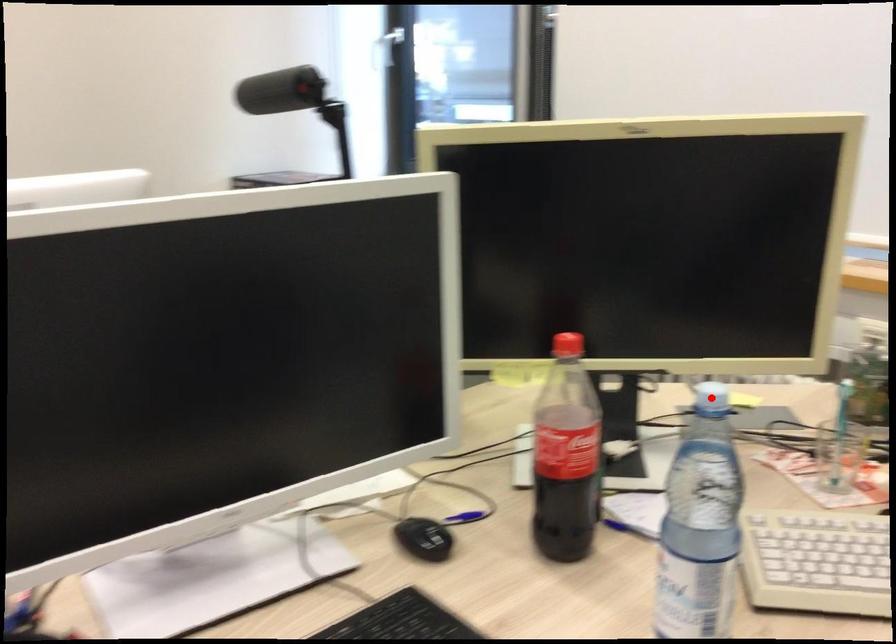
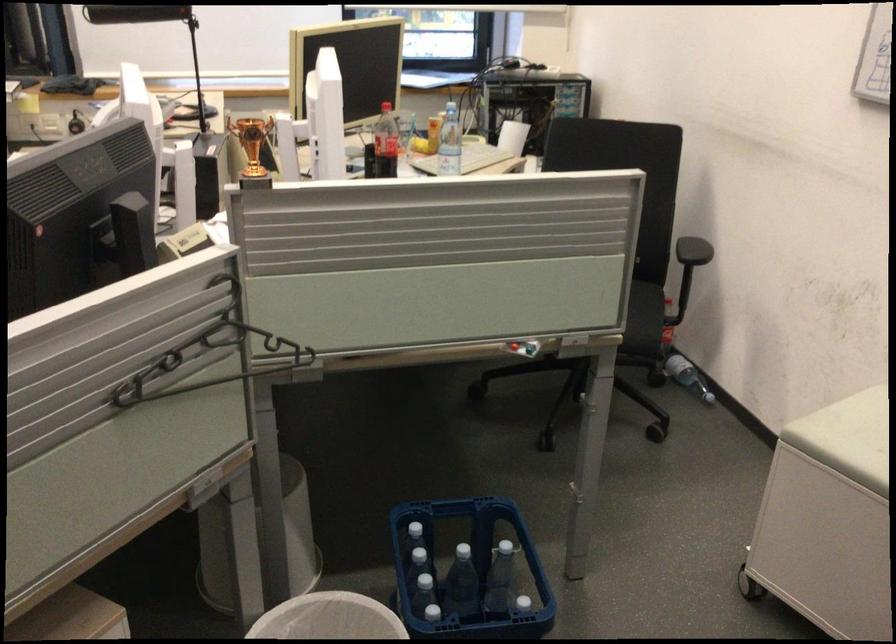
Question: I am providing you with two images of the same scene from different viewpoints. Given a red point in image1, look at the same physical point in image2. Is it:

Choices:
 (A) Closer to the viewpoint
 (B) Farther from the viewpoint

Answer: (B)